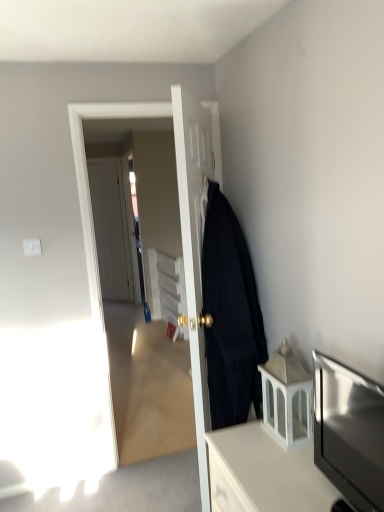
Question: Which direction should I rotate to face matte black coat at center, the second door positioned from the back, — up or down?

Choices:
 (A) up
 (B) down

Answer: (B)

Question: Is white glossy cabinet at lower right, marked as the second cabinetry in a top-to-bottom arrangement, in front of white glass lantern at lower right, the 1th cabinetry when ordered from top to bottom?

Choices:
 (A) no
 (B) yes

Answer: (B)

Question: From the image's perspective, is white glossy cabinet at lower right, marked as the second cabinetry in a top-to-bottom arrangement, under white glass lantern at lower right, which is the second cabinetry from bottom to top?

Choices:
 (A) no
 (B) yes

Answer: (B)

Question: Is white glossy cabinet at lower right, which is the first cabinetry in bottom-to-top order, oriented away from white glass lantern at lower right, which is the second cabinetry from bottom to top?

Choices:
 (A) no
 (B) yes

Answer: (A)

Question: Can you confirm if white glossy cabinet at lower right, which is the first cabinetry in bottom-to-top order, is shorter than white glass lantern at lower right, the 1th cabinetry when ordered from top to bottom?

Choices:
 (A) yes
 (B) no

Answer: (B)

Question: Is white glossy cabinet at lower right, marked as the second cabinetry in a top-to-bottom arrangement, outside white glass lantern at lower right, the 1th cabinetry when ordered from top to bottom?

Choices:
 (A) no
 (B) yes

Answer: (B)

Question: Does white glossy cabinet at lower right, which is the first cabinetry in bottom-to-top order, have a larger size compared to white glass lantern at lower right, the 1th cabinetry when ordered from top to bottom?

Choices:
 (A) no
 (B) yes

Answer: (B)

Question: Does matte black tv at lower right lie in front of black woolen coat at right?

Choices:
 (A) yes
 (B) no

Answer: (A)

Question: From a real-world perspective, is matte black tv at lower right physically below black woolen coat at right?

Choices:
 (A) no
 (B) yes

Answer: (B)

Question: Does matte black tv at lower right have a larger size compared to black woolen coat at right?

Choices:
 (A) yes
 (B) no

Answer: (B)

Question: Is matte black tv at lower right beside black woolen coat at right?

Choices:
 (A) yes
 (B) no

Answer: (B)

Question: Is matte black tv at lower right to the left of black woolen coat at right from the viewer's perspective?

Choices:
 (A) no
 (B) yes

Answer: (A)

Question: From a real-world perspective, is matte black tv at lower right over black woolen coat at right?

Choices:
 (A) no
 (B) yes

Answer: (A)

Question: Considering the relative sizes of matte black coat at center, positioned as the first door in front-to-back order, and white glass lantern at lower right, the 1th cabinetry when ordered from top to bottom, in the image provided, is matte black coat at center, positioned as the first door in front-to-back order, thinner than white glass lantern at lower right, the 1th cabinetry when ordered from top to bottom,?

Choices:
 (A) no
 (B) yes

Answer: (A)